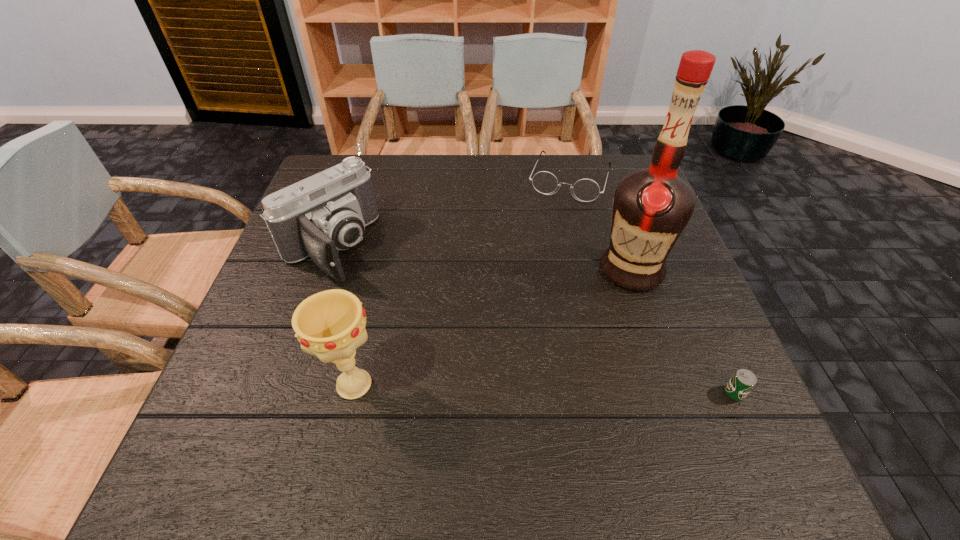
At what (x,y) coordinates should I click in order to perform the action: click on free space located 0.160m at the front of the third tallest object with an open lens cover. Please return your answer as a coordinate pair (x, y). Image resolution: width=960 pixels, height=540 pixels. Looking at the image, I should click on (394, 313).

Locate an element on the screen. The image size is (960, 540). vacant region located on the front and back of the tallest object is located at coordinates pos(505,376).

The height and width of the screenshot is (540, 960). Find the location of `vacant space situated on the front and back of the tallest object`. vacant space situated on the front and back of the tallest object is located at coordinates (540, 347).

Where is `blank space located on the front and back of the tallest object`? The image size is (960, 540). blank space located on the front and back of the tallest object is located at coordinates (497, 383).

Identify the location of vacant position located 0.290m on the front-facing side of the second shortest object. (536, 275).

Locate an element on the screen. free region located 0.210m on the front-facing side of the second shortest object is located at coordinates (543, 253).

This screenshot has width=960, height=540. Identify the location of vacant point located 0.360m on the front-facing side of the second shortest object. (528, 296).

This screenshot has height=540, width=960. What are the coordinates of `object at the far edge` in the screenshot? It's located at (586, 190).

The width and height of the screenshot is (960, 540). I want to click on chalice present at the near edge, so click(330, 324).

Image resolution: width=960 pixels, height=540 pixels. Find the location of `beer can positioned at the near edge`. beer can positioned at the near edge is located at coordinates tap(743, 381).